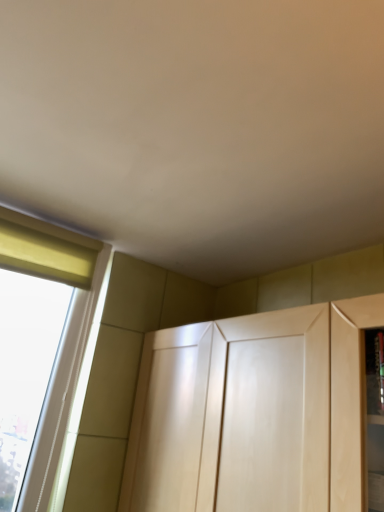
Describe the element at coordinates (254, 413) in the screenshot. I see `matte wood cabinet at center` at that location.

In order to click on matte wood cabinet at center in this screenshot , I will do `click(254, 413)`.

In order to face matte wood cabinet at center, should I rotate leftwards or rightwards?

It's best to rotate right around 7.896 degrees.

Measure the distance between matte wood cabinet at center and camera.

30.23 inches.

At what (x,y) coordinates should I click in order to perform the action: click on matte wood cabinet at center. Please return your answer as a coordinate pair (x, y). The image size is (384, 512). Looking at the image, I should click on 254,413.